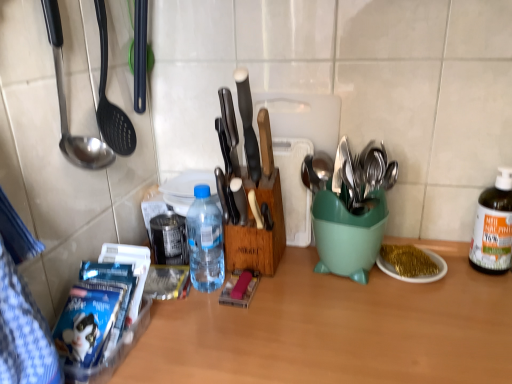
The height and width of the screenshot is (384, 512). Identify the location of vacant area that is in front of green plastic bottle at right, the 2th bottle when ordered from left to right. (485, 307).